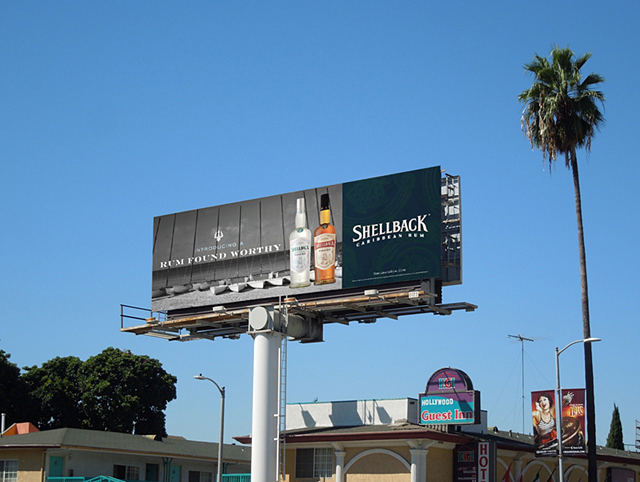
Image resolution: width=640 pixels, height=482 pixels. I want to click on glass, so click(312, 233).